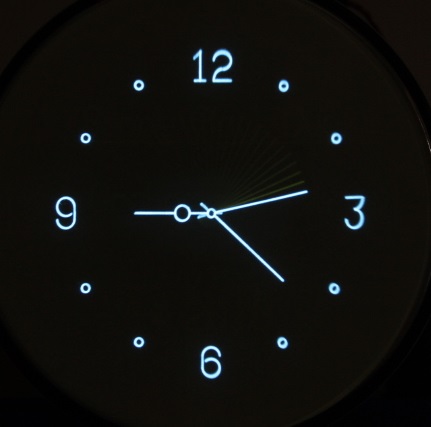
This screenshot has width=431, height=427. What are the coordinates of `circle in blue light denoting hours on clock/watch face` in the screenshot? It's located at (284, 88).